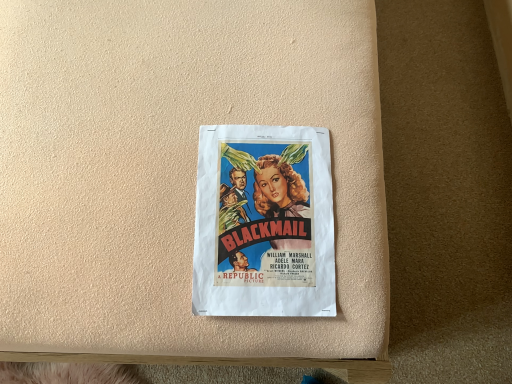
Where is `matte paper poster at center`? This screenshot has height=384, width=512. matte paper poster at center is located at coordinates (264, 222).

Describe the element at coordinates (264, 222) in the screenshot. The image size is (512, 384). I see `matte paper poster at center` at that location.

Locate an element on the screen. matte paper poster at center is located at coordinates (264, 222).